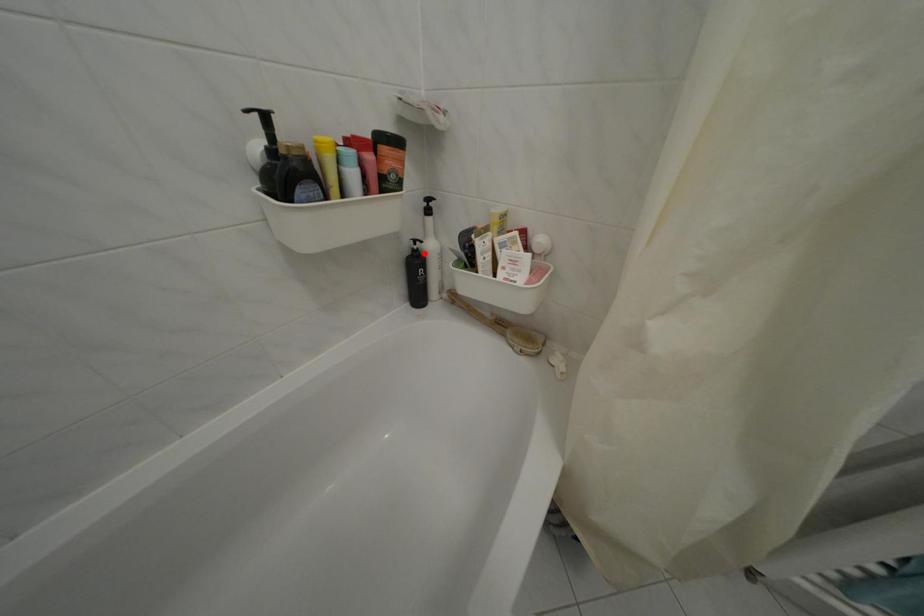
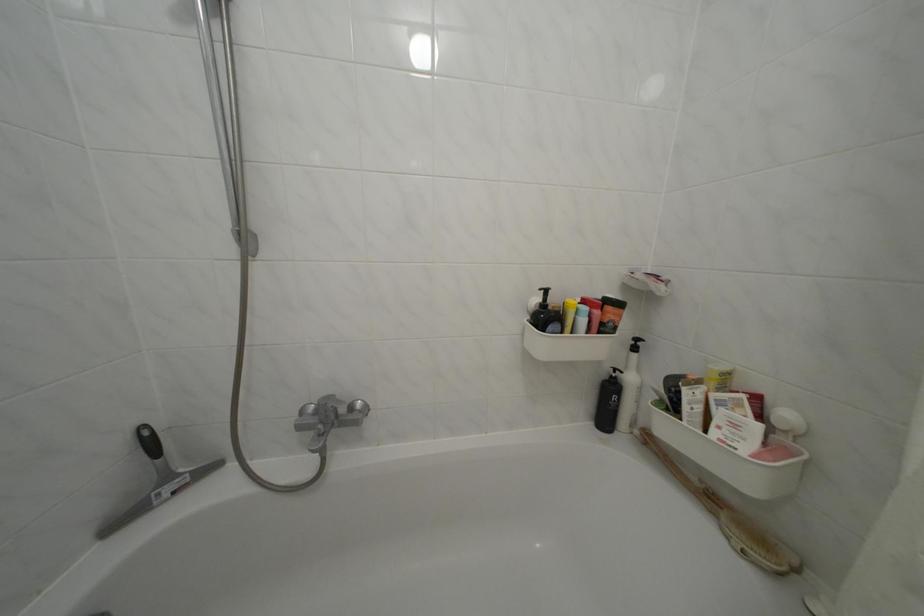
Find the pixel in the second image that matches the highlighted location in the first image.

(623, 381)